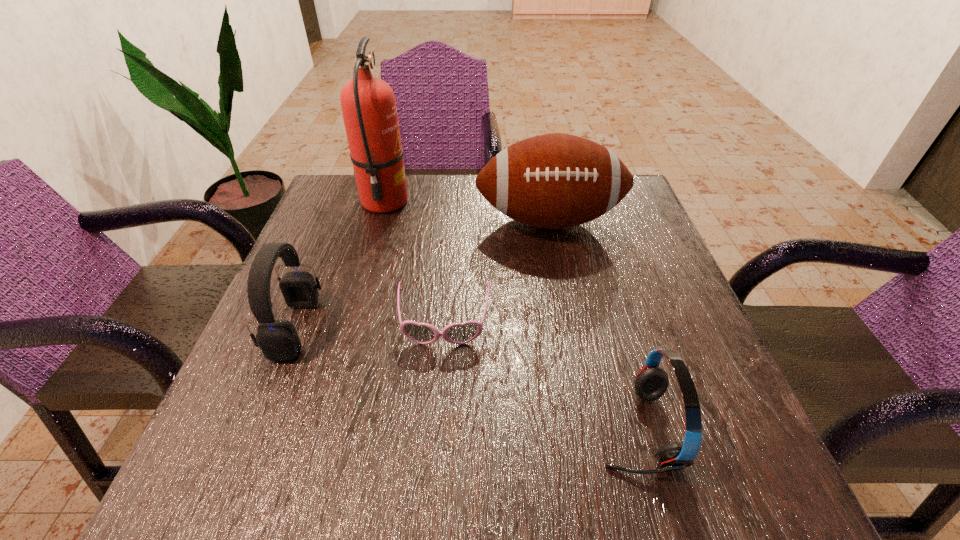
Where is `vacant space at the near left corner`? vacant space at the near left corner is located at coordinates (271, 484).

In order to click on free point at the near right corner in this screenshot , I will do `click(729, 440)`.

Where is `free space between the tallest object and the taller headset`? free space between the tallest object and the taller headset is located at coordinates (340, 265).

Locate an element on the screen. The width and height of the screenshot is (960, 540). free space between the right headset and the football is located at coordinates (592, 325).

You are a GUI agent. You are given a task and a screenshot of the screen. Output one action in this format:
    pyautogui.click(x=<x>, y=<y>)
    Task: Click on the vacant point located between the taller headset and the fourth shortest object
    Image resolution: width=960 pixels, height=540 pixels.
    Given the screenshot: What is the action you would take?
    pyautogui.click(x=422, y=274)

Where is `free point between the taller headset and the fire extinguisher`? This screenshot has height=540, width=960. free point between the taller headset and the fire extinguisher is located at coordinates (340, 265).

Where is `vacant region between the sunglasses and the tallest object`? This screenshot has height=540, width=960. vacant region between the sunglasses and the tallest object is located at coordinates (415, 264).

At what (x,y) coordinates should I click in order to perform the action: click on vacant area that lies between the fire extinguisher and the football. Please return your answer as a coordinate pair (x, y). This screenshot has height=540, width=960. Looking at the image, I should click on (467, 211).

At what (x,y) coordinates should I click in order to perform the action: click on vacant area that lies between the fourth object from right to left and the farther headset. Please return your answer as a coordinate pair (x, y). Looking at the image, I should click on (340, 265).

Find the location of a particular element. The image size is (960, 540). free space that is in between the sunglasses and the fire extinguisher is located at coordinates point(415,264).